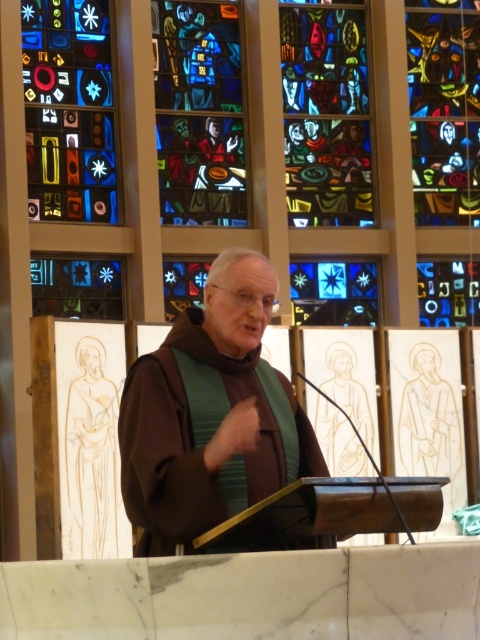
Can you confirm if multicolored stained glass at upper left is positioned below multicolored stained glass at center?

Indeed, multicolored stained glass at upper left is positioned under multicolored stained glass at center.

Who is more distant from viewer, (31,138) or (349,116)?

Positioned behind is point (349,116).

This screenshot has height=640, width=480. Find the location of `multicolored stained glass at upper left`. multicolored stained glass at upper left is located at coordinates (69, 109).

Who is lower down, brown velvety robe at center or stained glass window at center?

brown velvety robe at center is lower down.

You are a GUI agent. You are given a task and a screenshot of the screen. Output one action in this format:
    pyautogui.click(x=<x>, y=<y>)
    Task: Click on the brown velvety robe at center
    The image size is (480, 640).
    Given the screenshot: What is the action you would take?
    pyautogui.click(x=214, y=422)

This screenshot has height=640, width=480. I want to click on brown velvety robe at center, so click(x=214, y=422).

Between brown velvety robe at center and multicolored stained glass at upper right, which one appears on the left side from the viewer's perspective?

brown velvety robe at center

Image resolution: width=480 pixels, height=640 pixels. Describe the element at coordinates (214, 422) in the screenshot. I see `brown velvety robe at center` at that location.

Is point (257, 300) less distant than point (469, 8)?

Yes.

Identify the location of brown velvety robe at center. (214, 422).